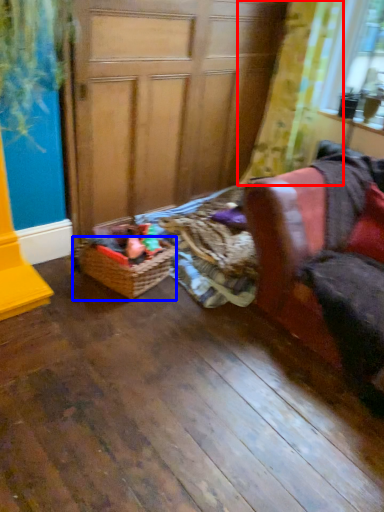
Question: Which of the following is the closest to the observer, curtain (highlighted by a red box) or basket (highlighted by a blue box)?

Choices:
 (A) curtain
 (B) basket

Answer: (B)